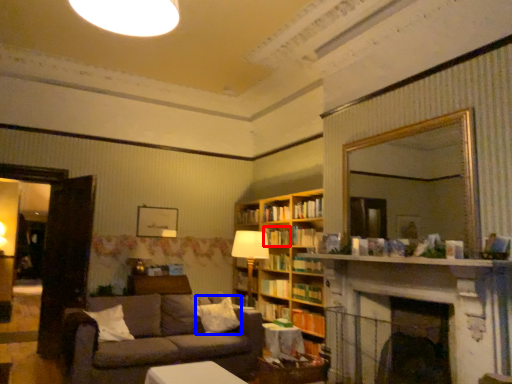
Question: Which object appears closest to the camera in this image, book (highlighted by a red box) or pillow (highlighted by a blue box)?

Choices:
 (A) book
 (B) pillow

Answer: (B)